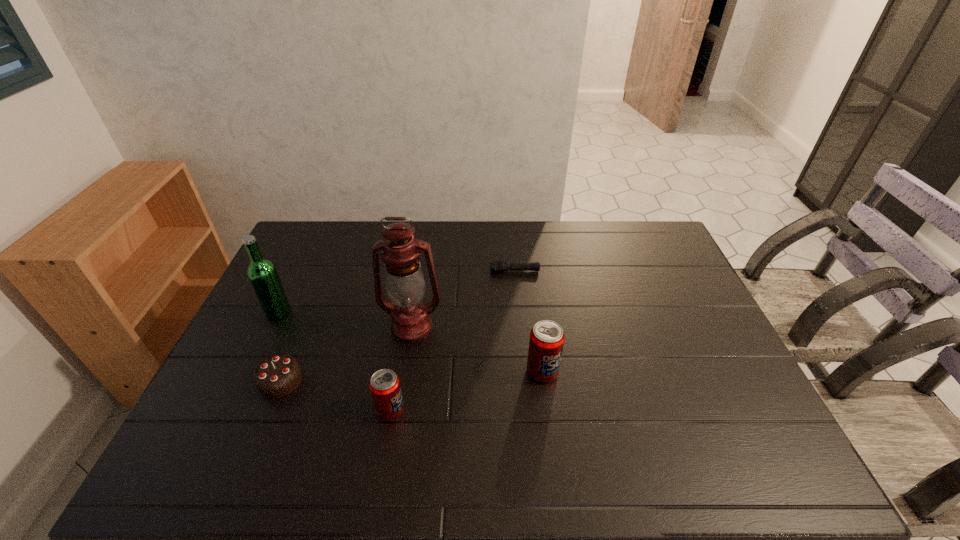
The height and width of the screenshot is (540, 960). In order to click on the left soda can in this screenshot , I will do `click(384, 385)`.

Where is `the third shortest object`? This screenshot has height=540, width=960. the third shortest object is located at coordinates (384, 385).

Where is `the fourth shortest object`? the fourth shortest object is located at coordinates (546, 342).

The width and height of the screenshot is (960, 540). I want to click on the taller soda can, so [x=546, y=342].

You are a GUI agent. You are given a task and a screenshot of the screen. Output one action in this format:
    pyautogui.click(x=<x>, y=<y>)
    Task: Click on the shortest object
    
    Given the screenshot: What is the action you would take?
    pyautogui.click(x=497, y=266)

I want to click on flashlight, so click(497, 266).

This screenshot has width=960, height=540. I want to click on the second shortest object, so click(278, 375).

Where is `the fifth shortest object`? the fifth shortest object is located at coordinates (263, 276).

Where is `oil lamp`? The image size is (960, 540). oil lamp is located at coordinates (405, 282).

Identify the location of free point located on the left of the nearer soda can. (337, 410).